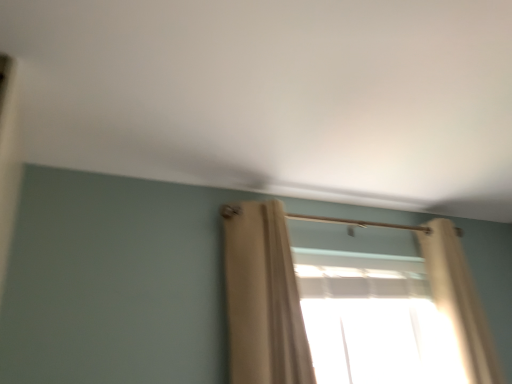
Question: Can you confirm if beige fabric curtain at center, placed as the second curtain when sorted from right to left, is positioned to the right of beige sheer curtain at right, the second curtain when ordered from left to right?

Choices:
 (A) yes
 (B) no

Answer: (B)

Question: From a real-world perspective, is beige fabric curtain at center, which is the first curtain in left-to-right order, positioned over beige sheer curtain at right, the second curtain when ordered from left to right, based on gravity?

Choices:
 (A) no
 (B) yes

Answer: (B)

Question: Are beige fabric curtain at center, placed as the second curtain when sorted from right to left, and beige sheer curtain at right, the 1th curtain in the right-to-left sequence, located far from each other?

Choices:
 (A) no
 (B) yes

Answer: (B)

Question: Does beige fabric curtain at center, which is the first curtain in left-to-right order, appear on the left side of beige sheer curtain at right, the 1th curtain in the right-to-left sequence?

Choices:
 (A) yes
 (B) no

Answer: (A)

Question: Could beige sheer curtain at right, the 1th curtain in the right-to-left sequence, be considered to be inside beige fabric curtain at center, which is the first curtain in left-to-right order?

Choices:
 (A) no
 (B) yes

Answer: (A)

Question: Considering the relative sizes of beige fabric curtain at center, which is the first curtain in left-to-right order, and beige sheer curtain at right, the second curtain when ordered from left to right, in the image provided, is beige fabric curtain at center, which is the first curtain in left-to-right order, thinner than beige sheer curtain at right, the second curtain when ordered from left to right,?

Choices:
 (A) yes
 (B) no

Answer: (A)

Question: Considering the relative positions of translucent fabric at center and beige sheer curtain at right, the 1th curtain in the right-to-left sequence, in the image provided, is translucent fabric at center to the right of beige sheer curtain at right, the 1th curtain in the right-to-left sequence, from the viewer's perspective?

Choices:
 (A) no
 (B) yes

Answer: (A)

Question: Can you see translucent fabric at center touching beige sheer curtain at right, the second curtain when ordered from left to right?

Choices:
 (A) yes
 (B) no

Answer: (B)

Question: Is translucent fabric at center at the left side of beige sheer curtain at right, the second curtain when ordered from left to right?

Choices:
 (A) no
 (B) yes

Answer: (B)

Question: From the image's perspective, is translucent fabric at center located above beige sheer curtain at right, the second curtain when ordered from left to right?

Choices:
 (A) yes
 (B) no

Answer: (B)

Question: Is translucent fabric at center positioned in front of beige sheer curtain at right, the 1th curtain in the right-to-left sequence?

Choices:
 (A) yes
 (B) no

Answer: (B)

Question: Is translucent fabric at center wider than beige sheer curtain at right, the second curtain when ordered from left to right?

Choices:
 (A) no
 (B) yes

Answer: (A)

Question: From the image's perspective, is beige fabric curtain at center, placed as the second curtain when sorted from right to left, under translucent fabric at center?

Choices:
 (A) yes
 (B) no

Answer: (B)